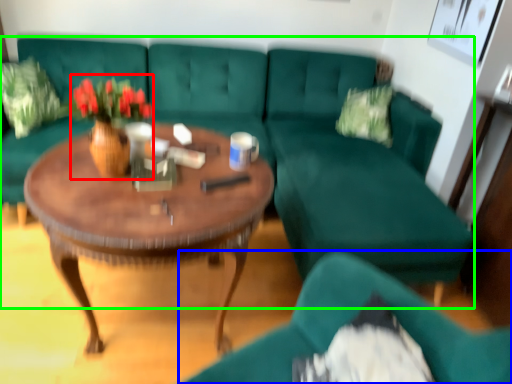
Question: Based on their relative distances, which object is nearer to floral arrangement (highlighted by a red box)? Choose from chair (highlighted by a blue box) and studio couch (highlighted by a green box).

Choices:
 (A) chair
 (B) studio couch

Answer: (A)